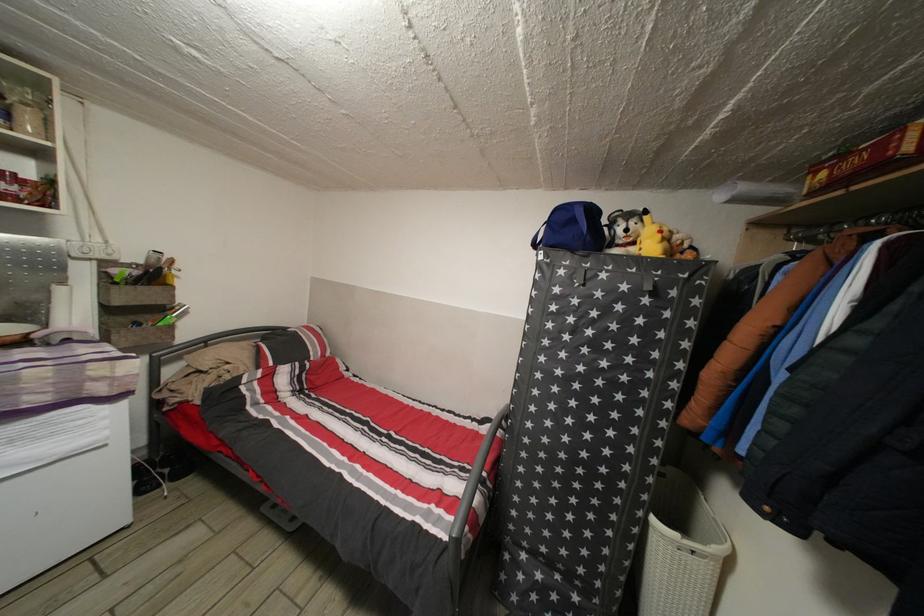
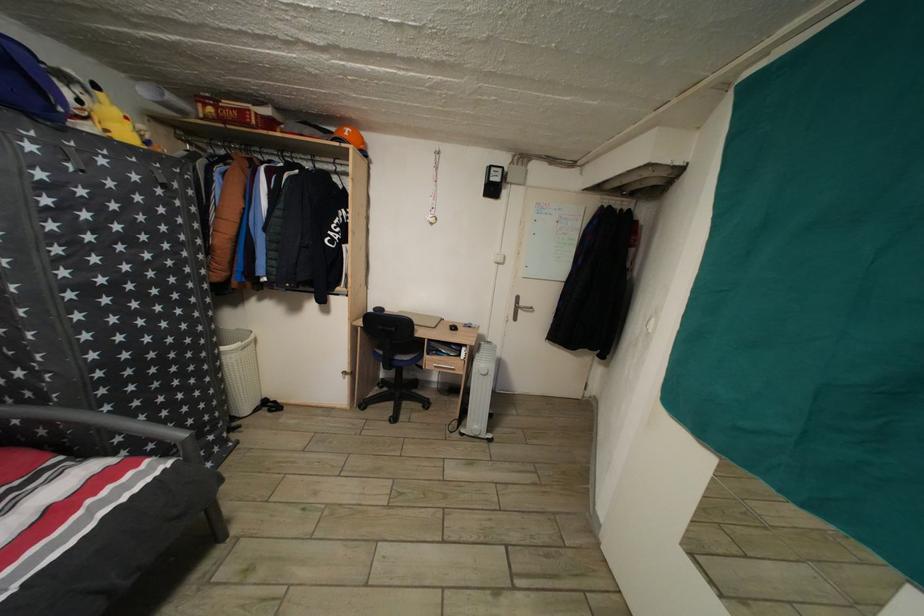
In the second image, find the point that corresponds to the point at 440,513 in the first image.

(96, 508)